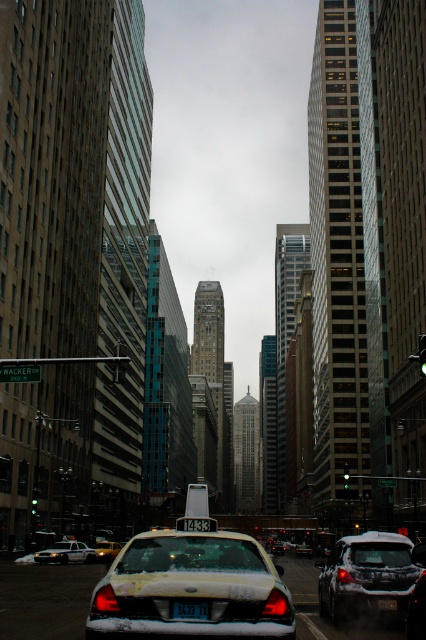
Question: Which point is farther from the camera taking this photo?

Choices:
 (A) (347, 557)
 (B) (143, 556)
 (C) (189, 604)
 (D) (115, 545)

Answer: (D)

Question: Among these points, which one is nearest to the camera?

Choices:
 (A) click(336, 580)
 (B) click(80, 548)

Answer: (A)

Question: Considering the relative positions of yellow matte taxi at center and yellow plastic taxi cab at center in the image provided, where is yellow matte taxi at center located with respect to yellow plastic taxi cab at center?

Choices:
 (A) above
 (B) below

Answer: (A)

Question: Considering the relative positions of snow-covered sedan at center and white plastic license plate at center in the image provided, where is snow-covered sedan at center located with respect to white plastic license plate at center?

Choices:
 (A) left
 (B) right

Answer: (A)

Question: Does snow-covered sedan at center appear on the left side of yellow matte taxi at center?

Choices:
 (A) no
 (B) yes

Answer: (A)

Question: Which point is farther to the camera?

Choices:
 (A) white plastic license plate at center
 (B) white matte taxi at center

Answer: (A)